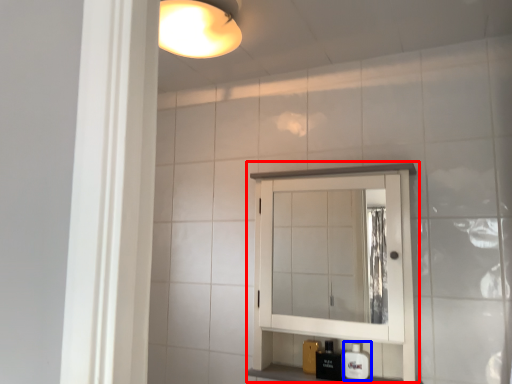
Question: Which object is further to the camera taking this photo, medicine cabinet (highlighted by a red box) or soap dispenser (highlighted by a blue box)?

Choices:
 (A) medicine cabinet
 (B) soap dispenser

Answer: (B)